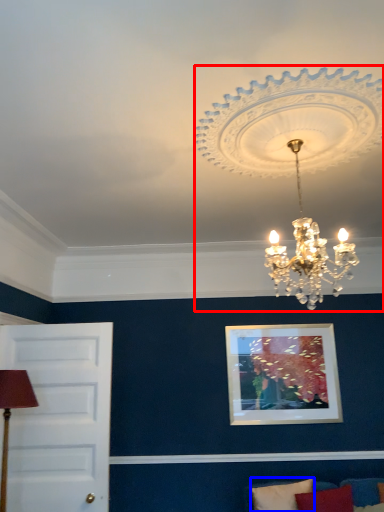
Question: Which of the following is the farthest to the observer, lamp (highlighted by a red box) or pillow (highlighted by a blue box)?

Choices:
 (A) lamp
 (B) pillow

Answer: (B)